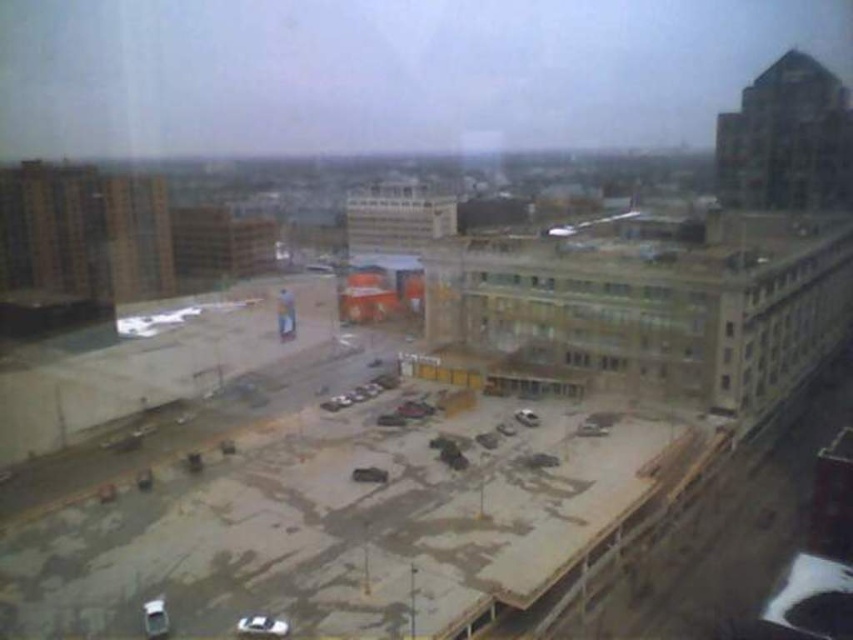
Question: Which object is farther from the camera taking this photo?

Choices:
 (A) white matte car at lower left
 (B) silver metallic car at lower center

Answer: (A)

Question: Which point appears farthest from the camera in this image?

Choices:
 (A) (143, 612)
 (B) (277, 636)

Answer: (A)

Question: Does silver metallic car at lower center have a greater width compared to white matte car at lower left?

Choices:
 (A) no
 (B) yes

Answer: (B)

Question: Does silver metallic car at lower center have a larger size compared to white matte car at lower left?

Choices:
 (A) no
 (B) yes

Answer: (B)

Question: Is silver metallic car at lower center bigger than white matte car at lower left?

Choices:
 (A) no
 (B) yes

Answer: (B)

Question: Which object is closer to the camera taking this photo?

Choices:
 (A) white matte car at lower left
 (B) silver metallic car at lower center

Answer: (B)